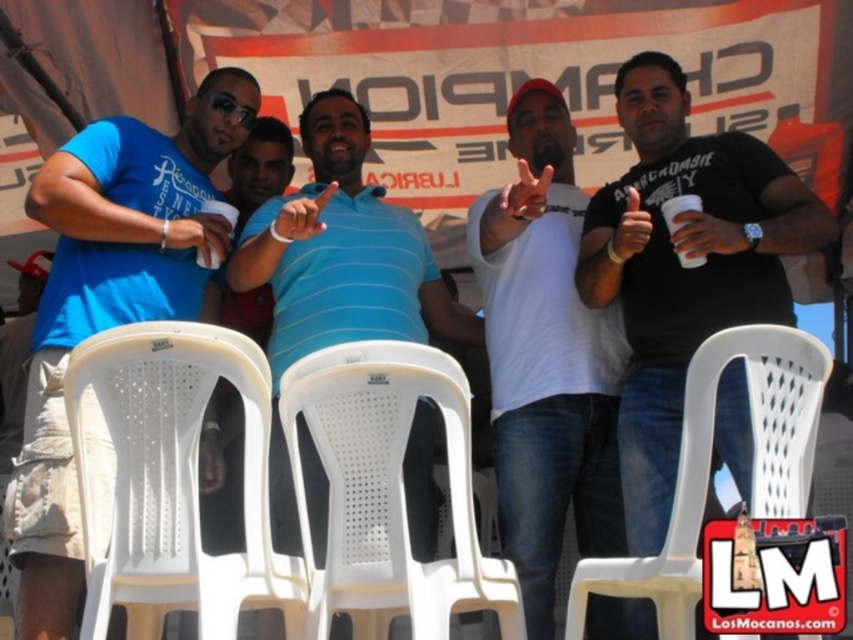
Question: Which point is farther from the camera taking this photo?

Choices:
 (A) (363, 394)
 (B) (262, 445)
 (C) (210, 259)
 (D) (306, 227)

Answer: (C)

Question: Among these points, which one is nearest to the camera?

Choices:
 (A) (210, 490)
 (B) (560, 456)
 (C) (672, 236)
 (D) (752, 417)

Answer: (D)

Question: Which of the following is the closest to the observer?

Choices:
 (A) (306, 204)
 (B) (238, 122)
 (C) (16, 320)

Answer: (A)

Question: Is black matte cup at right above matte black goggles at upper center?

Choices:
 (A) no
 (B) yes

Answer: (A)

Question: Can you confirm if white plastic cup at center is bigger than black matte cup at right?

Choices:
 (A) no
 (B) yes

Answer: (B)

Question: Is white matte cup at center right smaller than black matte hand at center?

Choices:
 (A) no
 (B) yes

Answer: (B)